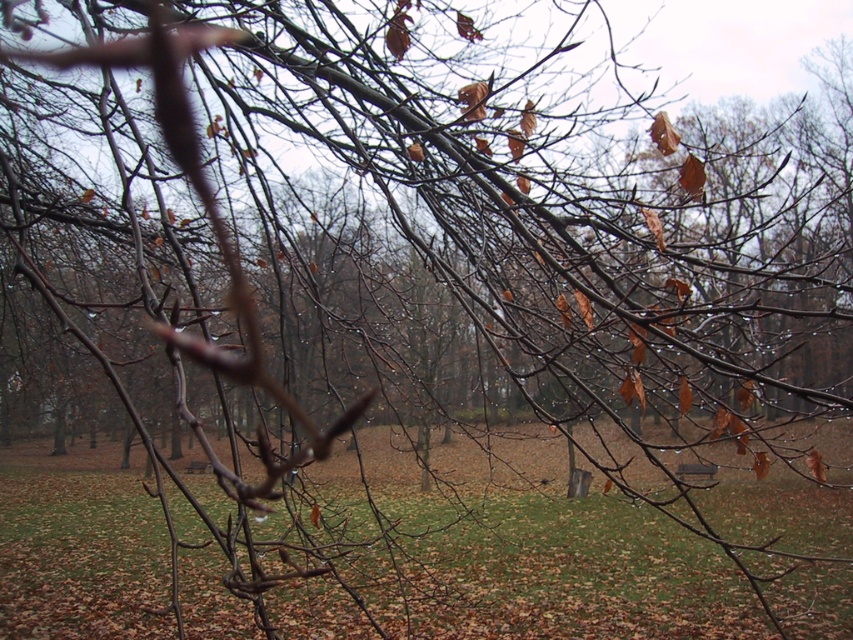
Is green matte grass at center positioned at the back of wooden park bench at center?

No, it is in front of wooden park bench at center.

Does green matte grass at center have a greater height compared to wooden park bench at center?

Correct, green matte grass at center is much taller as wooden park bench at center.

The image size is (853, 640). Describe the element at coordinates (575, 576) in the screenshot. I see `green matte grass at center` at that location.

What are the coordinates of `green matte grass at center` in the screenshot? It's located at (575, 576).